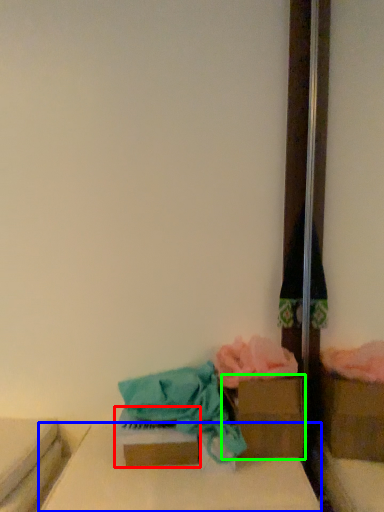
Question: Which object is positioned farthest from storage box (highlighted by a red box)? Select from furniture (highlighted by a blue box) and storage box (highlighted by a green box).

Choices:
 (A) furniture
 (B) storage box

Answer: (B)